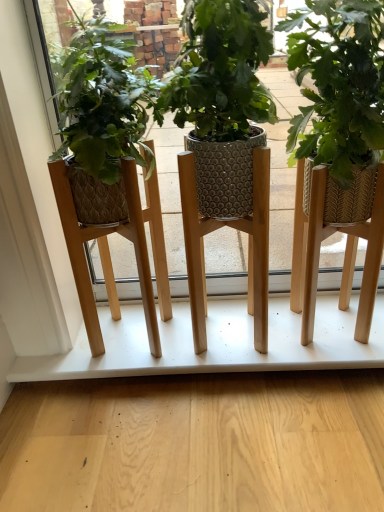
Question: From the image's perspective, is green woven basket at center above or below white matte shelf at center?

Choices:
 (A) below
 (B) above

Answer: (B)

Question: From their relative heights in the image, would you say green woven basket at center is taller or shorter than white matte shelf at center?

Choices:
 (A) short
 (B) tall

Answer: (B)

Question: Is point (309, 89) closer or farther from the camera than point (271, 326)?

Choices:
 (A) farther
 (B) closer

Answer: (A)

Question: From the image's perspective, relative to green woven basket at center, is white matte shelf at center above or below?

Choices:
 (A) above
 (B) below

Answer: (B)

Question: Do you think white matte shelf at center is within green woven basket at center, or outside of it?

Choices:
 (A) outside
 (B) inside

Answer: (A)

Question: Visually, is white matte shelf at center positioned to the left or to the right of green woven basket at center?

Choices:
 (A) right
 (B) left

Answer: (B)

Question: From a real-world perspective, relative to green woven basket at center, is white matte shelf at center vertically above or below?

Choices:
 (A) below
 (B) above

Answer: (A)